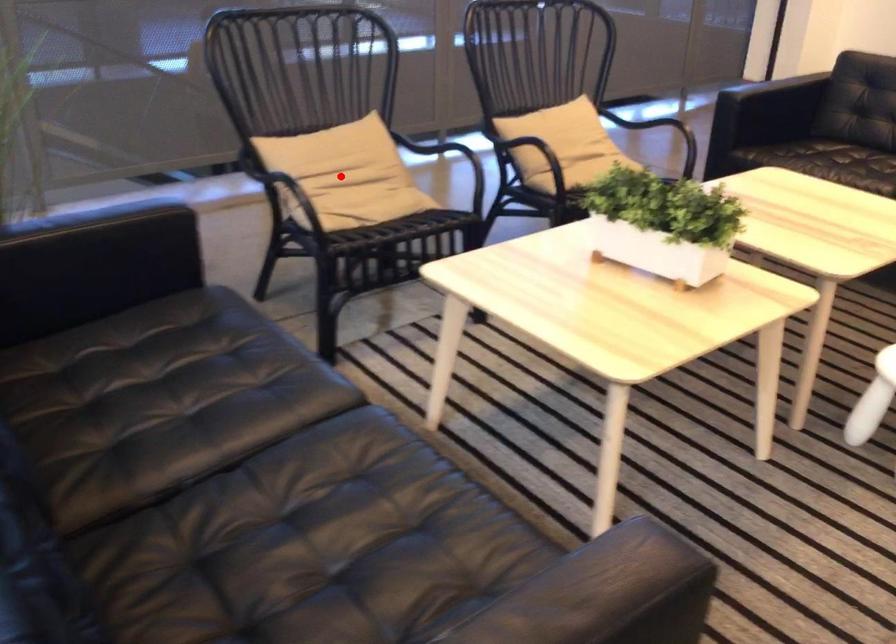
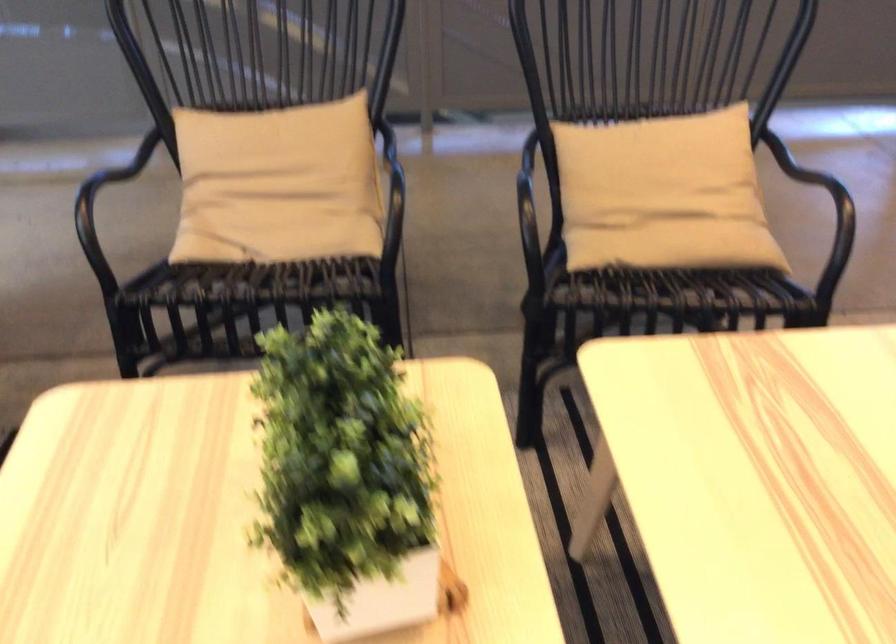
Question: I am providing you with two images of the same scene from different viewpoints. Image1 has a red point marked. In image2, the corresponding 3D location appears at what relative position? Reply with the corresponding letter.

Choices:
 (A) Closer
 (B) Farther

Answer: (A)